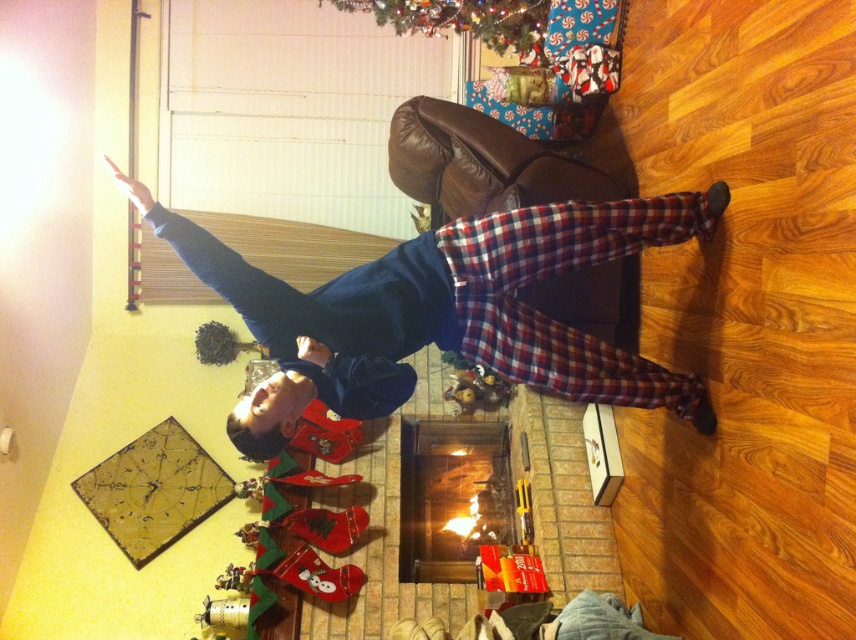
You are a guest at a holiday party and want to take a photo with the brick fireplace at center and the green matte christmas tree at upper center in the background. Which object should you stand closer to in order to capture both in the frame?

Since the brick fireplace at center is much taller than the green matte christmas tree at upper center, you should stand closer to the brick fireplace at center to ensure both objects are fully visible in the photo.